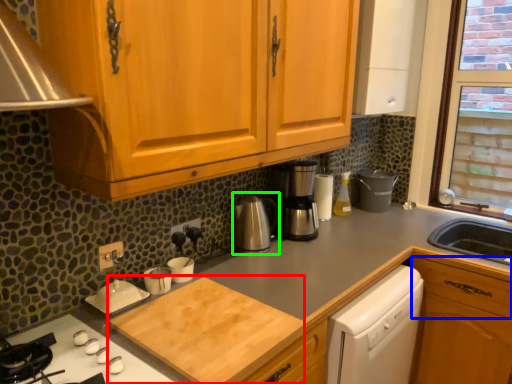
Question: Which is nearer to the cutting board (highlighted by a red box)? drawer (highlighted by a blue box) or coffeepot (highlighted by a green box).

Choices:
 (A) drawer
 (B) coffeepot

Answer: (B)